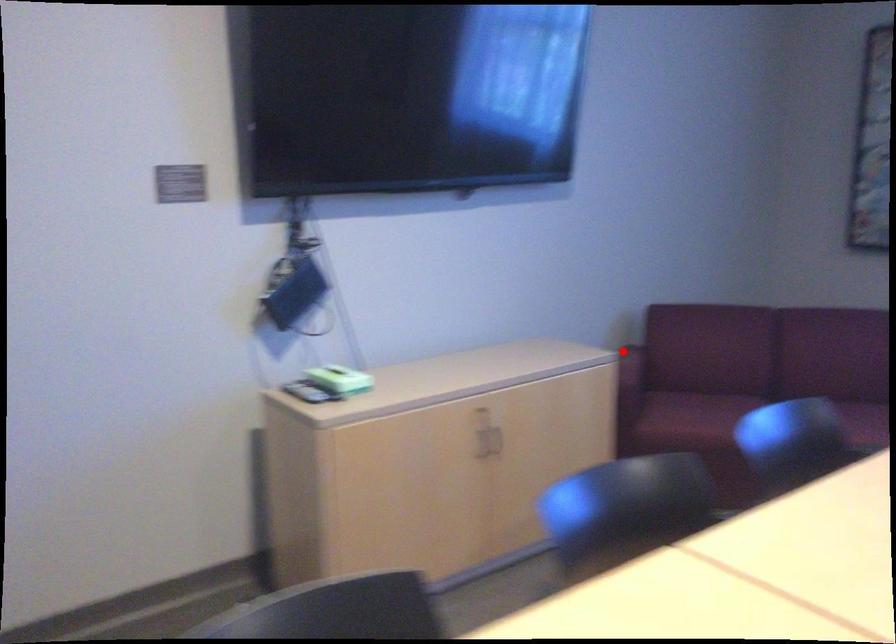
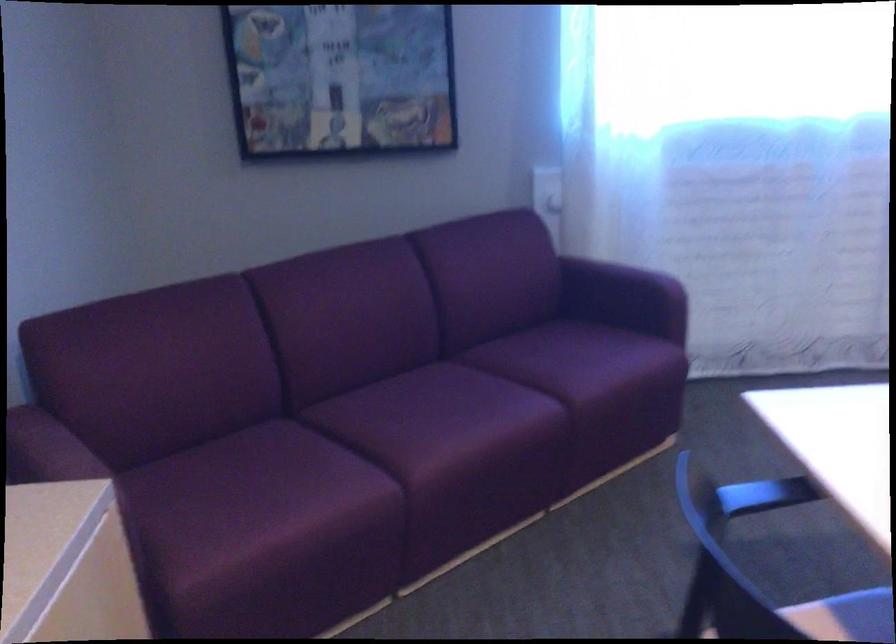
Question: I am providing you with two images of the same scene from different viewpoints. Image1 has a red point marked. In image2, the corresponding 3D location appears at what relative position? Reply with the corresponding letter.

Choices:
 (A) Closer
 (B) Farther

Answer: (A)